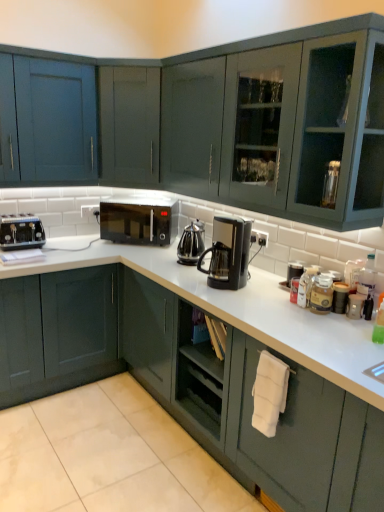
Question: Can you confirm if black plastic coffee pot at center is positioned to the right of matte black toaster at left?

Choices:
 (A) yes
 (B) no

Answer: (A)

Question: From a real-world perspective, is black plastic coffee pot at center positioned over matte black toaster at left based on gravity?

Choices:
 (A) yes
 (B) no

Answer: (A)

Question: Is black plastic coffee pot at center taller than matte black toaster at left?

Choices:
 (A) no
 (B) yes

Answer: (B)

Question: Is black plastic coffee pot at center to the left of matte black toaster at left from the viewer's perspective?

Choices:
 (A) no
 (B) yes

Answer: (A)

Question: Is matte black toaster at left a part of black plastic coffee pot at center?

Choices:
 (A) no
 (B) yes

Answer: (A)

Question: Can you confirm if black plastic coffee pot at center is wider than matte black toaster at left?

Choices:
 (A) yes
 (B) no

Answer: (B)

Question: Is the position of black matte microwave at center more distant than that of black plastic coffee maker at center?

Choices:
 (A) no
 (B) yes

Answer: (B)

Question: Considering the relative sizes of black matte microwave at center and black plastic coffee maker at center in the image provided, is black matte microwave at center bigger than black plastic coffee maker at center?

Choices:
 (A) yes
 (B) no

Answer: (A)

Question: Is black matte microwave at center to the right of black plastic coffee maker at center from the viewer's perspective?

Choices:
 (A) yes
 (B) no

Answer: (B)

Question: Can you confirm if black matte microwave at center is shorter than black plastic coffee maker at center?

Choices:
 (A) yes
 (B) no

Answer: (A)

Question: From a real-world perspective, is black matte microwave at center positioned under black plastic coffee maker at center based on gravity?

Choices:
 (A) yes
 (B) no

Answer: (A)

Question: Is black matte microwave at center looking in the opposite direction of black plastic coffee maker at center?

Choices:
 (A) no
 (B) yes

Answer: (A)

Question: Is black plastic coffee maker at center outside matte blue cabinet at upper left, placed as the first cabinetry when sorted from top to bottom?

Choices:
 (A) no
 (B) yes

Answer: (B)